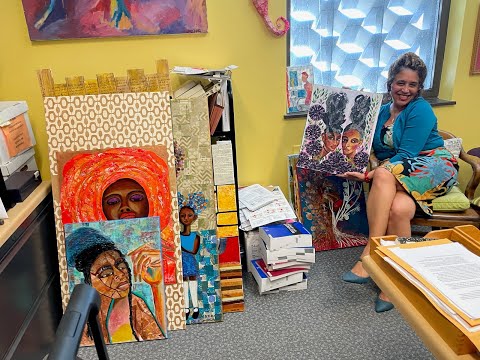
The width and height of the screenshot is (480, 360). In order to click on painting of woman in this screenshot , I will do `click(116, 276)`.